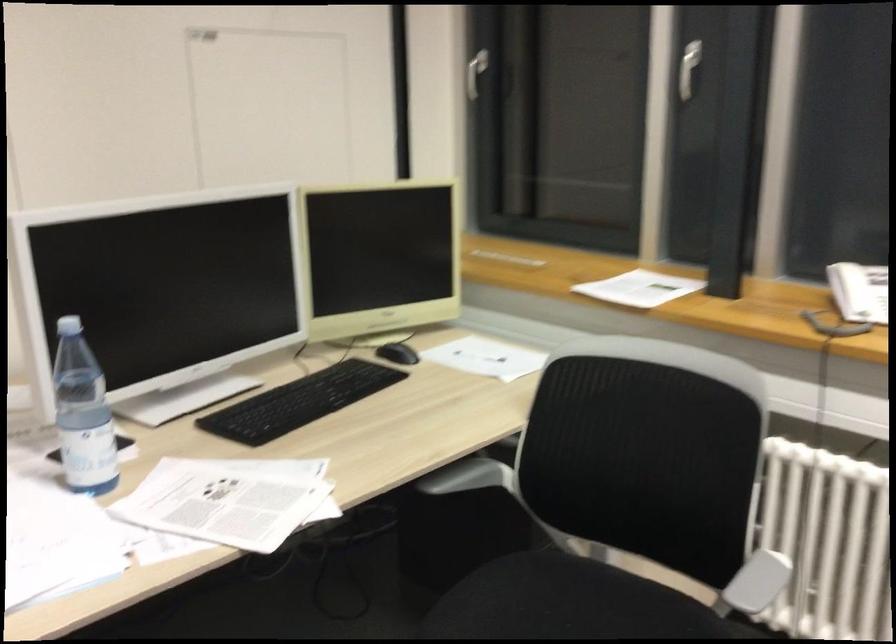
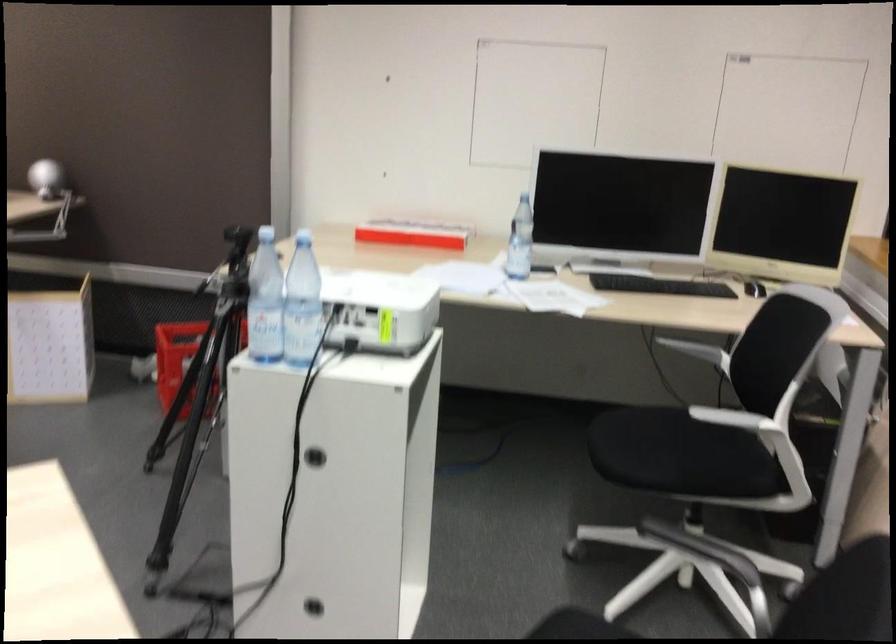
Find the pixel in the second image that matches the point at 71,422 in the first image.

(520, 241)